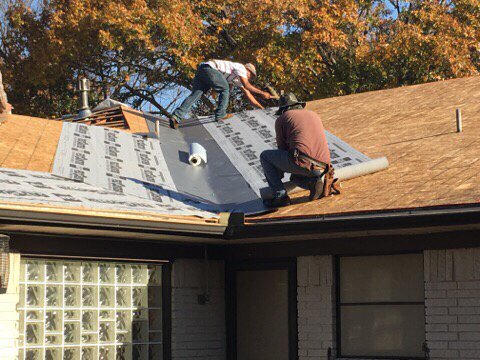
Where is `plywood on the left`? plywood on the left is located at coordinates (21, 152).